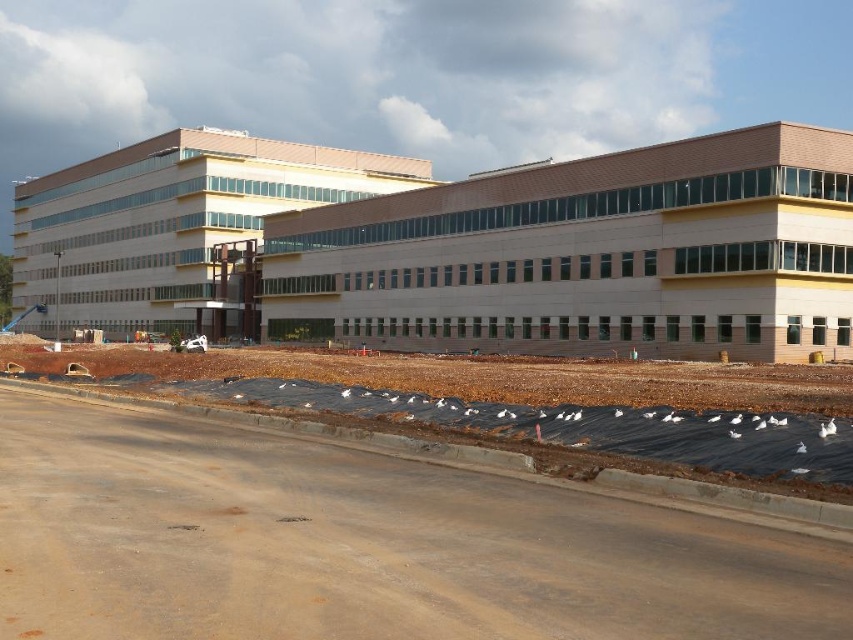
You are an architect reviewing the construction plans for the beige concrete building at center and the matte beige building at center. According to the provided image, which building should have its height adjusted to match the design specifications?

The beige concrete building at center has a lesser height compared to matte beige building at center, so the beige concrete building at center should be adjusted to match the height of the matte beige building at center as per the design specifications.

You are a construction worker observing the beige concrete building at center and the matte beige building at center. Which one is positioned lower in the image?

The beige concrete building at center is positioned lower than the matte beige building at center.